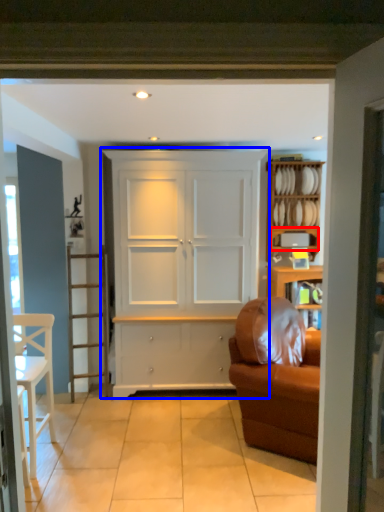
Question: Which point is further to the camera, shelf (highlighted by a red box) or cupboard (highlighted by a blue box)?

Choices:
 (A) shelf
 (B) cupboard

Answer: (A)